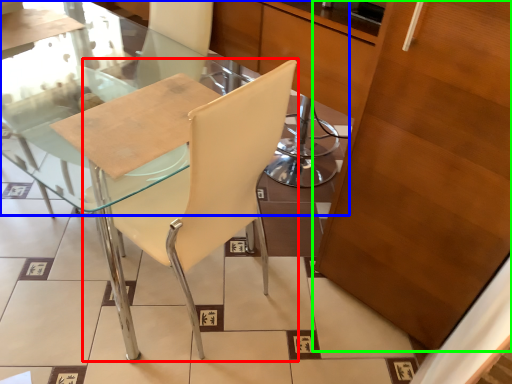
Question: Which is nearer to the chair (highlighted by a red box)? glass table (highlighted by a blue box) or cabinetry (highlighted by a green box).

Choices:
 (A) glass table
 (B) cabinetry

Answer: (B)